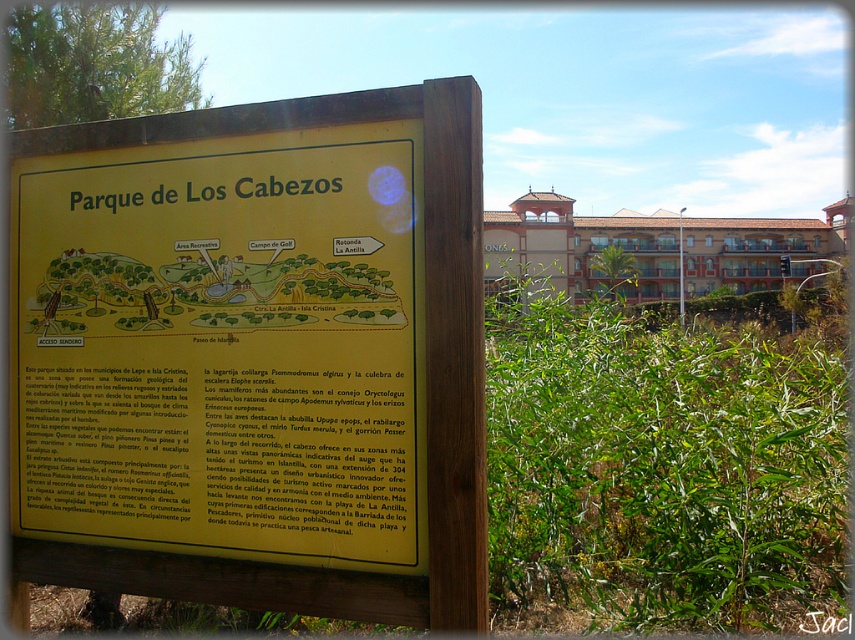
Question: Which of the following is the closest to the observer?

Choices:
 (A) green leafy plant at center
 (B) yellow matte sign at center

Answer: (B)

Question: Among these objects, which one is nearest to the camera?

Choices:
 (A) yellow matte sign at center
 (B) green leafy plant at center

Answer: (A)

Question: From the image, what is the correct spatial relationship of yellow matte sign at center in relation to green leafy plant at center?

Choices:
 (A) right
 (B) left

Answer: (B)

Question: Can you confirm if yellow matte sign at center is positioned to the right of green leafy plant at center?

Choices:
 (A) yes
 (B) no

Answer: (B)

Question: Does yellow matte sign at center have a greater width compared to green leafy plant at center?

Choices:
 (A) no
 (B) yes

Answer: (A)

Question: Which point appears farthest from the camera in this image?

Choices:
 (A) (500, 502)
 (B) (127, 572)

Answer: (A)